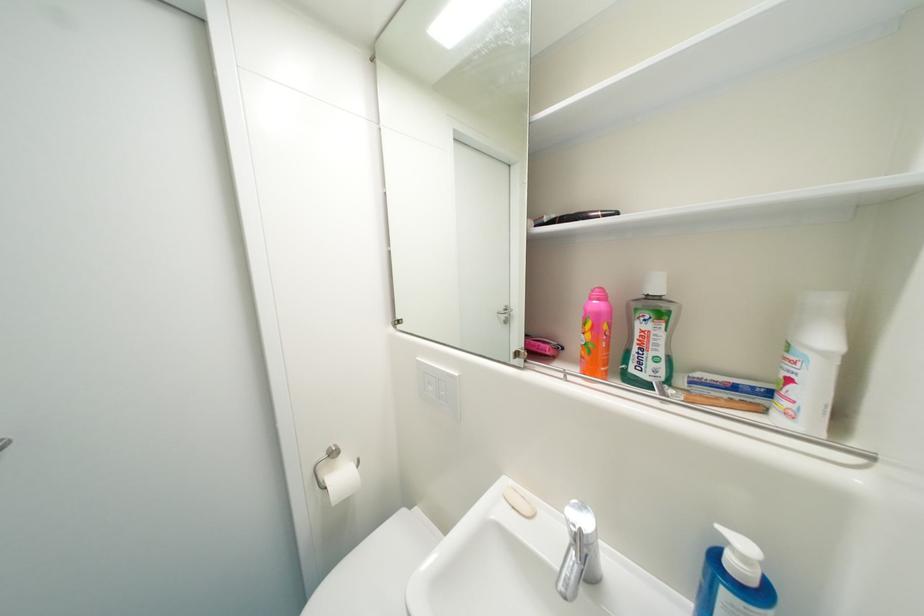
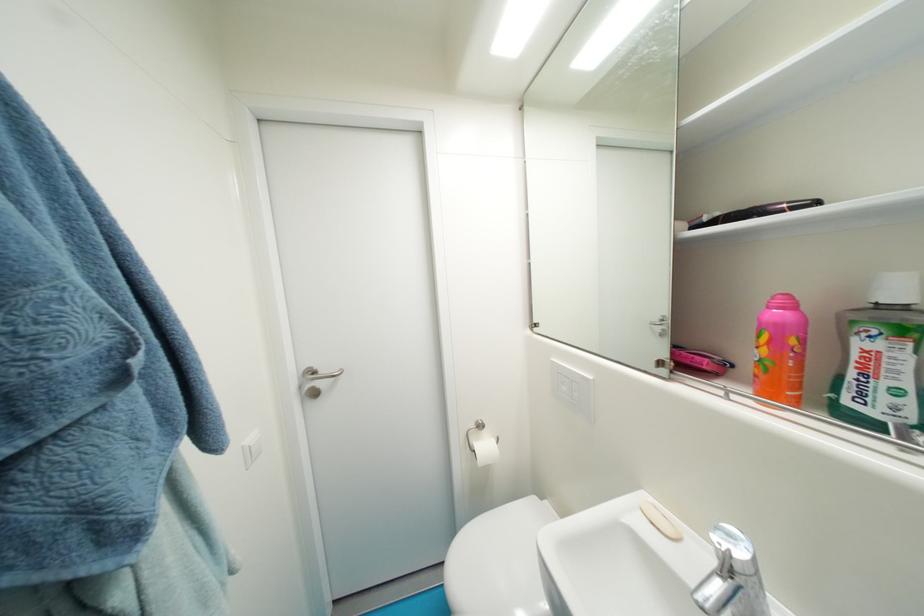
The point at (588, 532) is marked in the first image. Where is the corresponding point in the second image?

(736, 553)